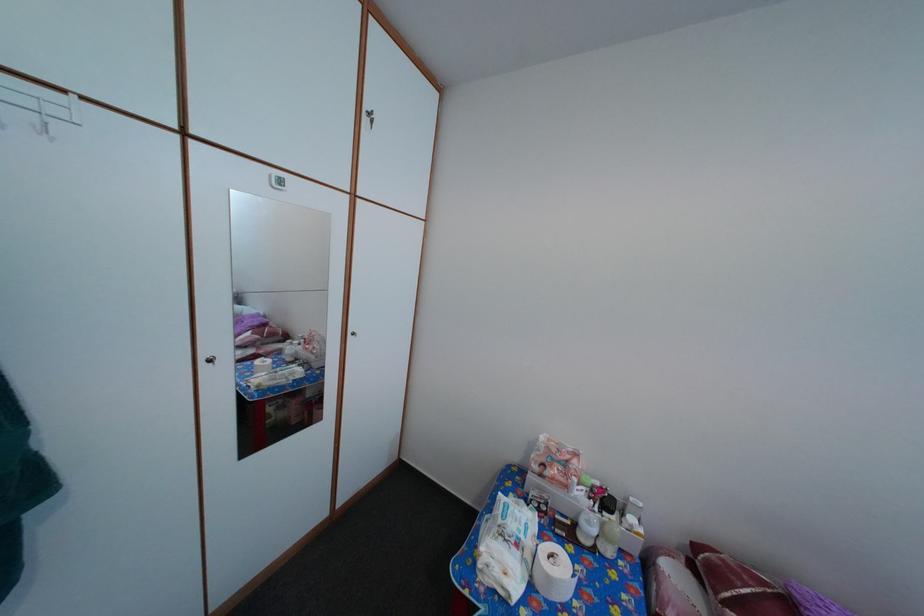
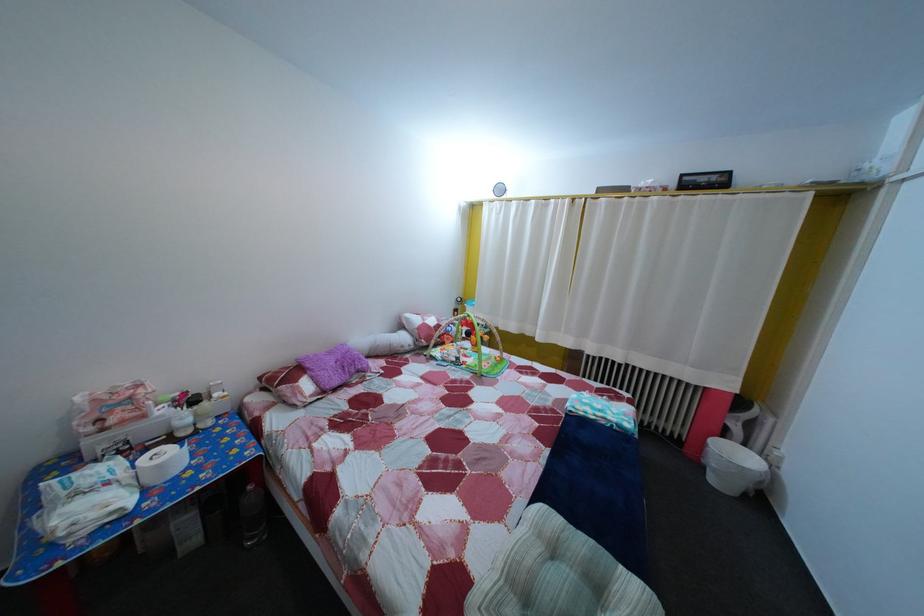
How did the camera likely rotate?

The rotation direction of the camera is right-down.